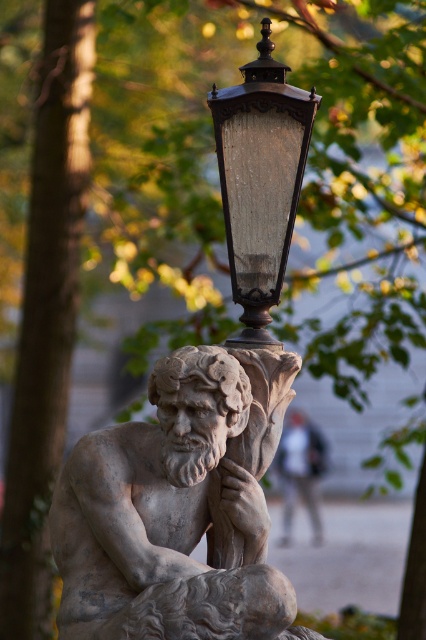
Question: Which point is farther to the camera?

Choices:
 (A) (215, 134)
 (B) (86, 452)

Answer: (A)

Question: Can you confirm if stone statue at center is positioned below wooden textured lantern at upper center?

Choices:
 (A) no
 (B) yes

Answer: (B)

Question: Is stone statue at center positioned behind wooden textured lantern at upper center?

Choices:
 (A) yes
 (B) no

Answer: (B)

Question: Does stone statue at center come in front of wooden textured lantern at upper center?

Choices:
 (A) yes
 (B) no

Answer: (A)

Question: Which point is closer to the camera?

Choices:
 (A) wooden textured lantern at upper center
 (B) stone statue at center

Answer: (B)